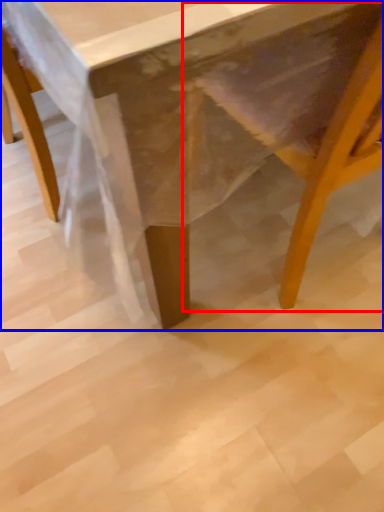
Question: Which object appears closest to the camera in this image, swivel chair (highlighted by a red box) or table (highlighted by a blue box)?

Choices:
 (A) swivel chair
 (B) table

Answer: (B)